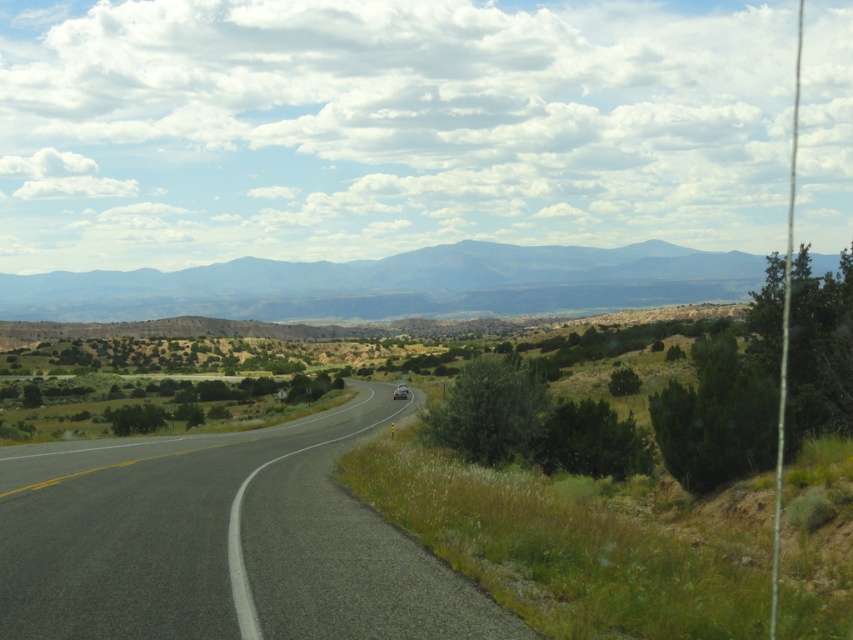
Can you confirm if asphalt road at center is bigger than metallic silver car at center?

Yes.

Who is positioned more to the right, asphalt road at center or metallic silver car at center?

metallic silver car at center is more to the right.

Who is more forward, (1, 529) or (404, 397)?

Point (1, 529)

Where is `asphalt road at center`? The height and width of the screenshot is (640, 853). asphalt road at center is located at coordinates (219, 540).

Is grayish-blue rock formation at center shorter than metallic silver car at center?

Incorrect, grayish-blue rock formation at center's height does not fall short of metallic silver car at center's.

Between grayish-blue rock formation at center and metallic silver car at center, which one appears on the right side from the viewer's perspective?

Positioned to the right is metallic silver car at center.

Does point (460, 243) come closer to viewer compared to point (403, 392)?

That is False.

This screenshot has height=640, width=853. In order to click on grayish-blue rock formation at center in this screenshot , I will do `click(393, 284)`.

Can you confirm if asphalt road at center is taller than grayish-blue rock formation at center?

No, asphalt road at center is not taller than grayish-blue rock formation at center.

Which is in front, point (190, 520) or point (230, 276)?

Positioned in front is point (190, 520).

Is point (192, 572) positioned after point (283, 275)?

No, (192, 572) is in front of (283, 275).

Identify the location of asphalt road at center. The image size is (853, 640). (219, 540).